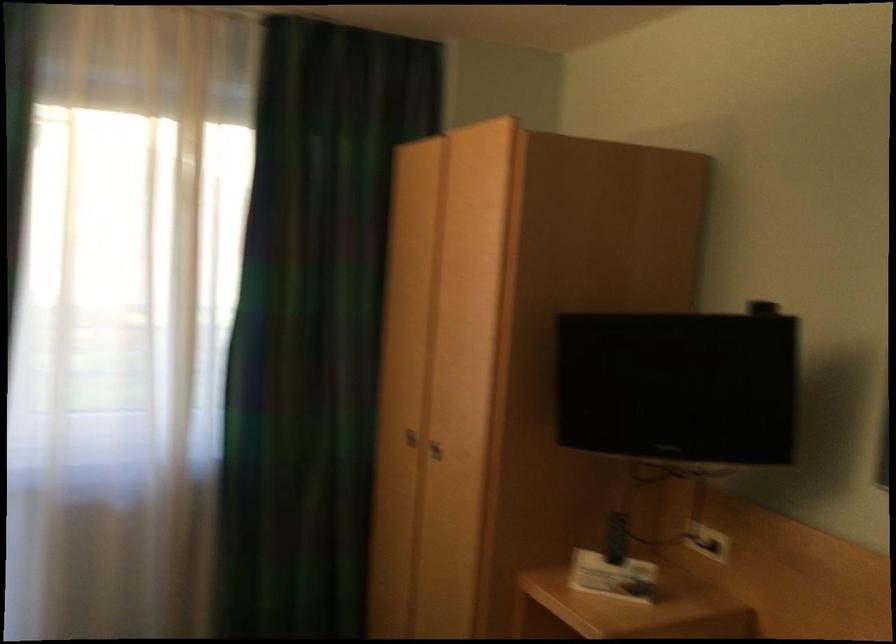
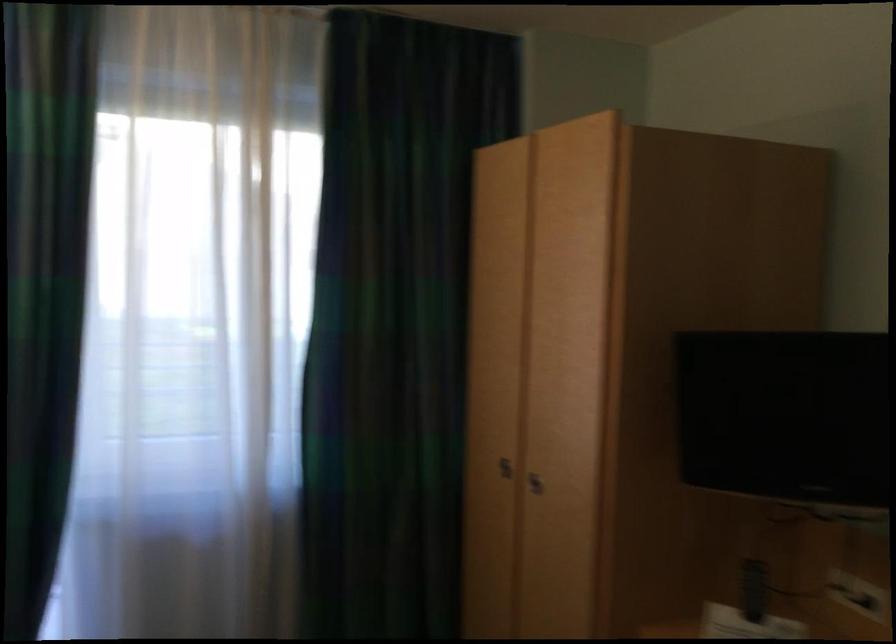
In a continuous first-person perspective shot, in which direction is the camera moving?

The cameraman walked toward left, forward.